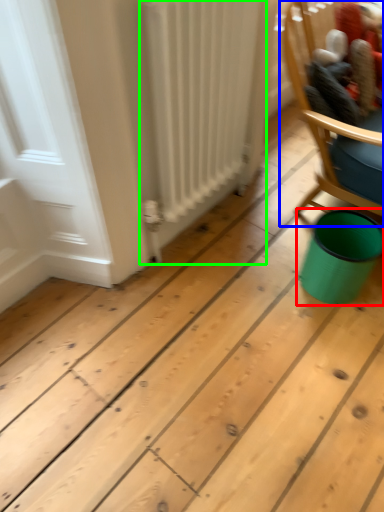
Question: Which object is positioned farthest from teal (highlighted by a red box)? Select from chair (highlighted by a blue box) and radiator (highlighted by a green box).

Choices:
 (A) chair
 (B) radiator

Answer: (B)